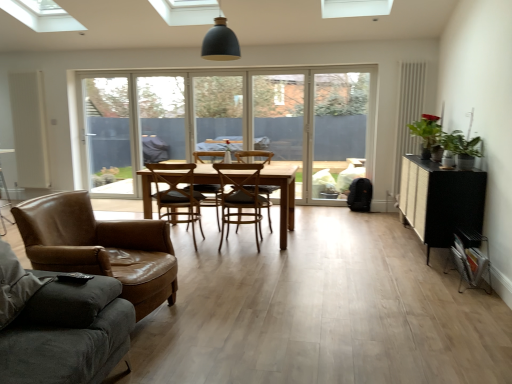
I want to click on vacant area that lies to the right of light brown wooden table at center, so click(x=338, y=236).